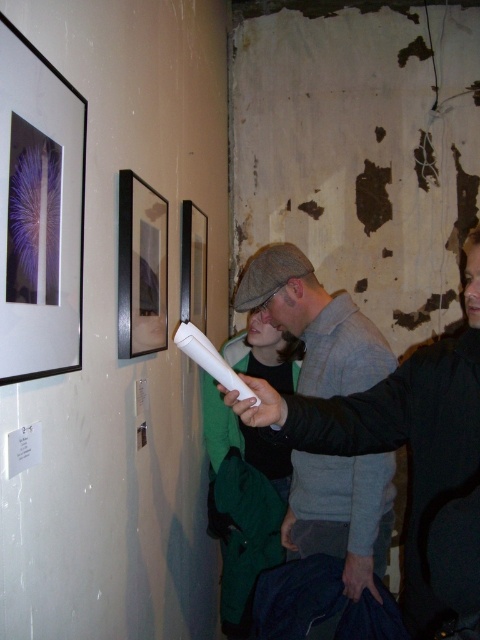
You are standing in the art gallery and want to take a photo of the black wood picture frame at center. The gallery has a rule that you must stay at least 1 meter away from all artworks. Given that your camera has a maximum zoom range of 5 meters, can you capture the frame without moving closer than the required distance?

The black wood picture frame at center is located at point coordinates, but without knowing the exact distance from your position to the frame, it is impossible to determine if the camera can capture it within the 5 meter zoom range while maintaining the 1 meter safety distance.

You are an art curator standing in the gallery. You need to move a new artwork between the black wood picture frame at center and the black glossy picture frame at upper center. The artwork is 40 centimeters wide. Will it fit between them?

The black wood picture frame at center and the black glossy picture frame at upper center are 41.50 centimeters apart. Since the artwork is 40 centimeters wide, it will fit between them as there is enough space.

You are an art curator walking through the gallery. You need to adjust the lighting for the matte black picture frame at upper left and the black glossy picture frame at upper center. Since you can only adjust one at a time, which frame should you adjust first if you want to start with the one that is positioned to the left?

You should adjust the matte black picture frame at upper left first because it is positioned to the left of the black glossy picture frame at upper center.